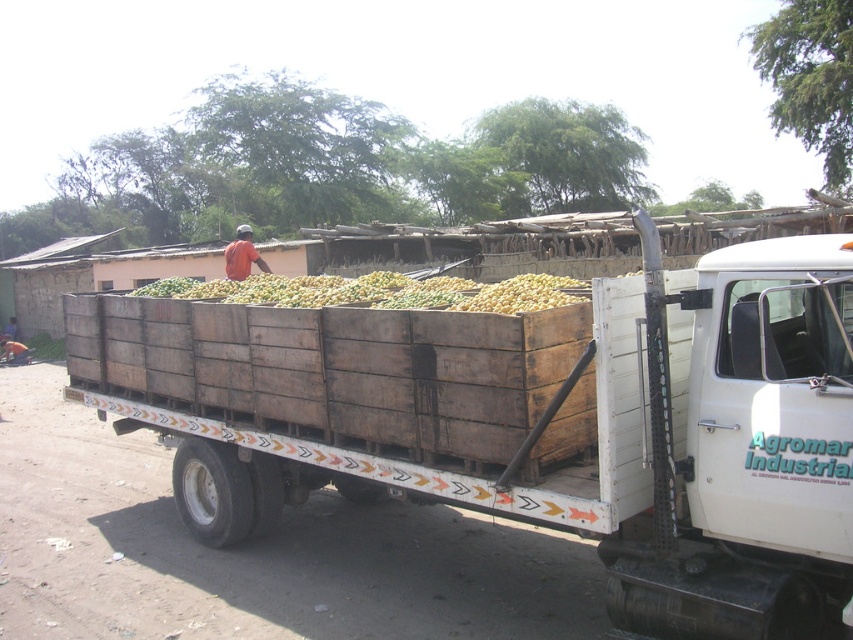
You are a delivery driver who needs to unload the wooden crates at center and the yellow matte produce at center from the truck. Which item requires more space when placing them on the storage shelves?

The wooden crates at center is bigger than yellow matte produce at center, so the wooden crates at center requires more space when placing them on the storage shelves.

Based on the photo, you are standing in front of the truck and looking at the two points marked on the image. Which point, point (271, 440) or point (410, 284), is closer to you?

Point (271, 440) is closer to you than point (410, 284).

You are a delivery person checking the loading of a truck. You notice the wooden crates at center and the yellow matte produce at center. Which object is located to the right of the other?

The wooden crates at center is positioned on the right side of yellow matte produce at center.